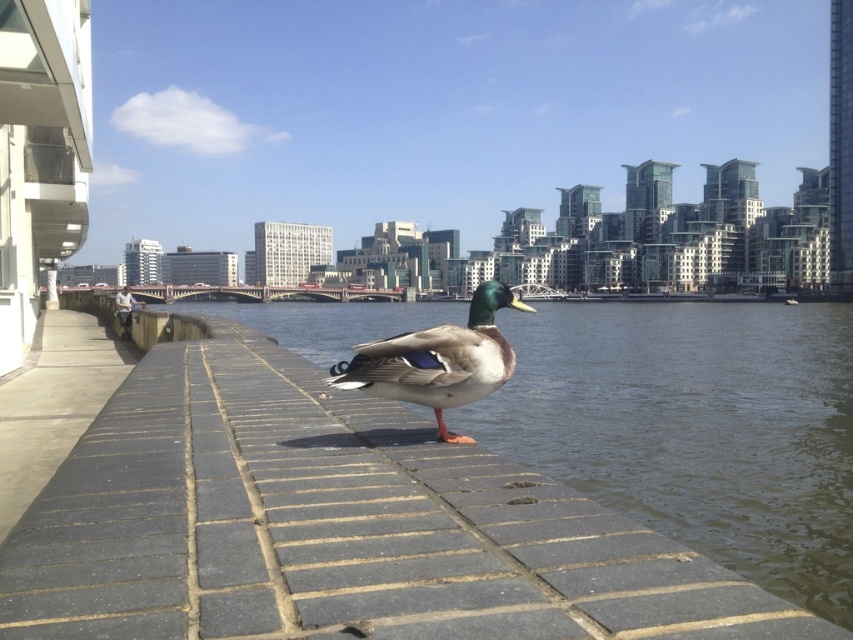
Does clear water at center appear over gray concrete pavement at lower left?

Indeed, clear water at center is positioned over gray concrete pavement at lower left.

I want to click on clear water at center, so click(x=695, y=428).

Does gray concrete pavement at lower left have a lesser width compared to green glossy duck at center?

No, gray concrete pavement at lower left is not thinner than green glossy duck at center.

Between gray concrete pavement at lower left and green glossy duck at center, which one appears on the left side from the viewer's perspective?

gray concrete pavement at lower left

Locate an element on the screen. This screenshot has width=853, height=640. gray concrete pavement at lower left is located at coordinates (53, 403).

Where is `gray concrete pavement at lower left`? The image size is (853, 640). gray concrete pavement at lower left is located at coordinates (53, 403).

Consider the image. Measure the distance from clear water at center to green glossy duck at center.

A distance of 64.60 meters exists between clear water at center and green glossy duck at center.

Is clear water at center above green glossy duck at center?

Yes.

You are a GUI agent. You are given a task and a screenshot of the screen. Output one action in this format:
    pyautogui.click(x=<x>, y=<y>)
    Task: Click on the clear water at center
    This screenshot has width=853, height=640.
    Given the screenshot: What is the action you would take?
    pyautogui.click(x=695, y=428)

Locate an element on the screen. clear water at center is located at coordinates (695, 428).